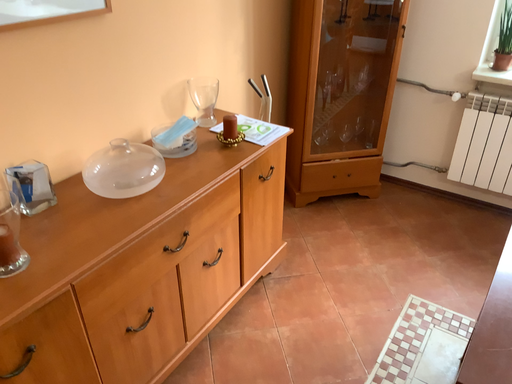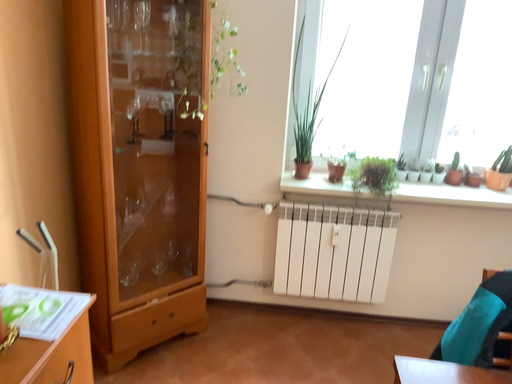
Question: Which way did the camera rotate in the video?

Choices:
 (A) rotated upward
 (B) rotated downward

Answer: (A)